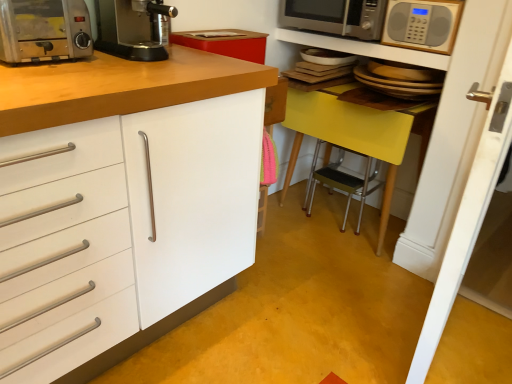
The height and width of the screenshot is (384, 512). What do you see at coordinates (44, 30) in the screenshot?
I see `metallic silver toaster at upper left` at bounding box center [44, 30].

Find the location of `satin silver microwave at upper right, which appears as the 1th microwave oven when viewed from the back`. satin silver microwave at upper right, which appears as the 1th microwave oven when viewed from the back is located at coordinates (335, 17).

This screenshot has width=512, height=384. Describe the element at coordinates (342, 181) in the screenshot. I see `metallic silver step stool at center` at that location.

This screenshot has height=384, width=512. Describe the element at coordinates (357, 133) in the screenshot. I see `yellow plastic table at right` at that location.

At what (x,y) coordinates should I click in order to perform the action: click on metallic silver microwave at upper center. Please return your answer as a coordinate pair (x, y). Looking at the image, I should click on (364, 48).

I want to click on silver metallic microwave at upper right, positioned as the 2th microwave oven in back-to-front order, so click(x=422, y=24).

From a real-world perspective, which object rests below the other?

satin silver microwave at upper right, marked as the second microwave oven in a front-to-back arrangement, from a real-world perspective.

Consider the image. Are satin silver microwave at upper right, which appears as the 1th microwave oven when viewed from the back, and silver metallic microwave at upper right, positioned as the 2th microwave oven in back-to-front order, far apart?

No.

Looking at this image, how different are the orientations of satin silver microwave at upper right, marked as the second microwave oven in a front-to-back arrangement, and silver metallic microwave at upper right, positioned as the 2th microwave oven in back-to-front order, in degrees?

They differ by 1.87 degrees in their facing directions.

Find the location of `microwave oven on the left of silver metallic microwave at upper right, positioned as the 2th microwave oven in back-to-front order`. microwave oven on the left of silver metallic microwave at upper right, positioned as the 2th microwave oven in back-to-front order is located at coordinates (335, 17).

Who is taller, metallic silver step stool at center or metallic silver toaster at upper left?

metallic silver step stool at center.

From a real-world perspective, is metallic silver step stool at center on top of metallic silver toaster at upper left?

Actually, metallic silver step stool at center is physically below metallic silver toaster at upper left in the real world.

Which object is more forward, metallic silver step stool at center or metallic silver toaster at upper left?

metallic silver toaster at upper left.

Is metallic silver step stool at center thinner than metallic silver toaster at upper left?

Yes, metallic silver step stool at center is thinner than metallic silver toaster at upper left.

Considering the points (11, 5) and (408, 129), which point is in front, point (11, 5) or point (408, 129)?

The point (11, 5) is more forward.

Which object is closer to the camera taking this photo, metallic silver toaster at upper left or yellow plastic table at right?

metallic silver toaster at upper left is in front.

Do you think metallic silver toaster at upper left is within yellow plastic table at right, or outside of it?

metallic silver toaster at upper left is spatially situated outside yellow plastic table at right.

Which of these two, metallic silver toaster at upper left or yellow plastic table at right, is wider?

With larger width is yellow plastic table at right.

Is metallic silver step stool at center taller than yellow plastic table at right?

In fact, metallic silver step stool at center may be shorter than yellow plastic table at right.

From the image's perspective, is metallic silver step stool at center below yellow plastic table at right?

Correct, metallic silver step stool at center appears lower than yellow plastic table at right in the image.

Considering the points (362, 201) and (366, 110), which point is in front, point (362, 201) or point (366, 110)?

Positioned in front is point (366, 110).

Considering the sizes of metallic silver step stool at center and yellow plastic table at right in the image, is metallic silver step stool at center bigger or smaller than yellow plastic table at right?

metallic silver step stool at center is smaller than yellow plastic table at right.

Considering the sizes of objects metallic silver toaster at upper left and silver metallic microwave at upper right, marked as the first microwave oven in a front-to-back arrangement, in the image provided, who is smaller, metallic silver toaster at upper left or silver metallic microwave at upper right, marked as the first microwave oven in a front-to-back arrangement,?

With smaller size is silver metallic microwave at upper right, marked as the first microwave oven in a front-to-back arrangement.

At what (x,y) coordinates should I click in order to perform the action: click on the 2nd microwave oven to the right of the metallic silver toaster at upper left, starting your count from the anchor. Please return your answer as a coordinate pair (x, y). The height and width of the screenshot is (384, 512). Looking at the image, I should click on (422, 24).

Looking at this image, from the image's perspective, is metallic silver toaster at upper left on top of silver metallic microwave at upper right, positioned as the 2th microwave oven in back-to-front order?

No, from the image's perspective, metallic silver toaster at upper left is not above silver metallic microwave at upper right, positioned as the 2th microwave oven in back-to-front order.

Is there a large distance between metallic silver toaster at upper left and silver metallic microwave at upper right, positioned as the 2th microwave oven in back-to-front order?

Yes, metallic silver toaster at upper left and silver metallic microwave at upper right, positioned as the 2th microwave oven in back-to-front order, are quite far apart.

Is point (450, 6) closer to viewer compared to point (302, 119)?

Yes.

Is silver metallic microwave at upper right, positioned as the 2th microwave oven in back-to-front order, oriented towards yellow plastic table at right?

No, silver metallic microwave at upper right, positioned as the 2th microwave oven in back-to-front order, is not aimed at yellow plastic table at right.

Which object is further away from the camera, silver metallic microwave at upper right, positioned as the 2th microwave oven in back-to-front order, or yellow plastic table at right?

yellow plastic table at right is further from the camera.

Image resolution: width=512 pixels, height=384 pixels. In order to click on microwave oven that is the 2nd one when counting forward from the yellow plastic table at right in this screenshot , I will do `click(422, 24)`.

Visually, is yellow plastic table at right positioned to the left or to the right of metallic silver toaster at upper left?

yellow plastic table at right is to the right of metallic silver toaster at upper left.

From a real-world perspective, is yellow plastic table at right physically located above or below metallic silver toaster at upper left?

From a real-world perspective, yellow plastic table at right is physically below metallic silver toaster at upper left.

Does yellow plastic table at right turn towards metallic silver toaster at upper left?

Yes, yellow plastic table at right faces towards metallic silver toaster at upper left.

Which of these two, yellow plastic table at right or metallic silver toaster at upper left, is thinner?

metallic silver toaster at upper left is thinner.

You are a GUI agent. You are given a task and a screenshot of the screen. Output one action in this format:
    pyautogui.click(x=<x>, y=<y>)
    Task: Click on the microwave oven that appears above the satin silver microwave at upper right, which appears as the 1th microwave oven when viewed from the back (from a real-world perspective)
    This screenshot has width=512, height=384.
    Given the screenshot: What is the action you would take?
    pyautogui.click(x=422, y=24)

Where is `step stool lying on the right of metallic silver toaster at upper left`? Image resolution: width=512 pixels, height=384 pixels. step stool lying on the right of metallic silver toaster at upper left is located at coordinates (342, 181).

Based on their spatial positions, is yellow plastic table at right or metallic silver step stool at center closer to silver metallic microwave at upper right, marked as the first microwave oven in a front-to-back arrangement?

Based on the image, yellow plastic table at right appears to be nearer to silver metallic microwave at upper right, marked as the first microwave oven in a front-to-back arrangement.

From the image, which object appears to be farther from silver metallic microwave at upper right, marked as the first microwave oven in a front-to-back arrangement, satin silver microwave at upper right, which appears as the 1th microwave oven when viewed from the back, or metallic silver microwave at upper center?

satin silver microwave at upper right, which appears as the 1th microwave oven when viewed from the back, lies further to silver metallic microwave at upper right, marked as the first microwave oven in a front-to-back arrangement, than the other object.

Estimate the real-world distances between objects in this image. Which object is further from metallic silver toaster at upper left, yellow plastic table at right or metallic silver microwave at upper center?

yellow plastic table at right is further to metallic silver toaster at upper left.

Looking at the image, which one is located further to black plastic coffee machine at upper center, satin silver microwave at upper right, which appears as the 1th microwave oven when viewed from the back, or yellow plastic table at right?

Among the two, yellow plastic table at right is located further to black plastic coffee machine at upper center.

Which object lies nearer to the anchor point metallic silver microwave at upper center, silver metallic microwave at upper right, positioned as the 2th microwave oven in back-to-front order, or metallic silver toaster at upper left?

Among the two, silver metallic microwave at upper right, positioned as the 2th microwave oven in back-to-front order, is located nearer to metallic silver microwave at upper center.

In the scene shown: Considering their positions, is satin silver microwave at upper right, marked as the second microwave oven in a front-to-back arrangement, positioned closer to black plastic coffee machine at upper center than metallic silver toaster at upper left?

metallic silver toaster at upper left.

In the scene shown: Based on their spatial positions, is silver metallic microwave at upper right, marked as the first microwave oven in a front-to-back arrangement, or satin silver microwave at upper right, marked as the second microwave oven in a front-to-back arrangement, closer to metallic silver microwave at upper center?

The object closer to metallic silver microwave at upper center is satin silver microwave at upper right, marked as the second microwave oven in a front-to-back arrangement.

When comparing their distances from metallic silver toaster at upper left, does yellow plastic table at right or metallic silver step stool at center seem closer?

yellow plastic table at right is positioned closer to the anchor metallic silver toaster at upper left.

Locate an element on the screen. This screenshot has height=384, width=512. shelf located between black plastic coffee machine at upper center and silver metallic microwave at upper right, marked as the first microwave oven in a front-to-back arrangement, in the left-right direction is located at coordinates (364, 48).

You are a GUI agent. You are given a task and a screenshot of the screen. Output one action in this format:
    pyautogui.click(x=<x>, y=<y>)
    Task: Click on the shelf between silver metallic microwave at upper right, positioned as the 2th microwave oven in back-to-front order, and metallic silver step stool at center in the front-back direction
    This screenshot has width=512, height=384.
    Given the screenshot: What is the action you would take?
    pyautogui.click(x=364, y=48)

Find the location of `table located between metallic silver toaster at upper left and metallic silver step stool at center in the left-right direction`. table located between metallic silver toaster at upper left and metallic silver step stool at center in the left-right direction is located at coordinates (357, 133).

At what (x,y) coordinates should I click in order to perform the action: click on kitchen appliance positioned between metallic silver toaster at upper left and metallic silver step stool at center from near to far. Please return your answer as a coordinate pair (x, y). The image size is (512, 384). Looking at the image, I should click on (134, 28).